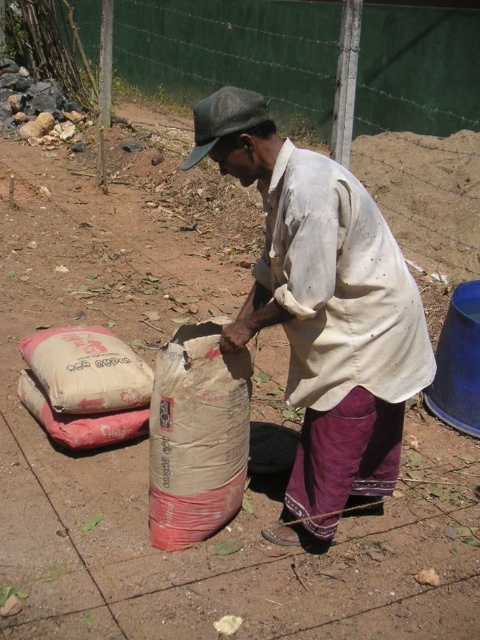
You are a delivery person who needs to place a new sack between the brown paper sack at center and the white paper sack at lower left. Based on their positions, where should you place the new sack?

The brown paper sack at center is positioned on the right side of white paper sack at lower left, so you should place the new sack between them on the right side of the white paper sack at lower left and left side of the brown paper sack at center.

You are standing at the origin point in the image. The white paper sack at lower left is represented by point (86,369). Which direction should you move to reach the sack?

The white paper sack at lower left is located at point (86,369). Since the coordinate system typically has the origin at the top left corner, moving towards the lower left direction would reach the sack.

You are standing at the origin point in the image and want to reach the sack located at point (229, 397). Which direction should you move relative to the other sack at point (90, 333)?

You should move towards the front direction relative to the sack at point (90, 333) because point (229, 397) is in front of it.